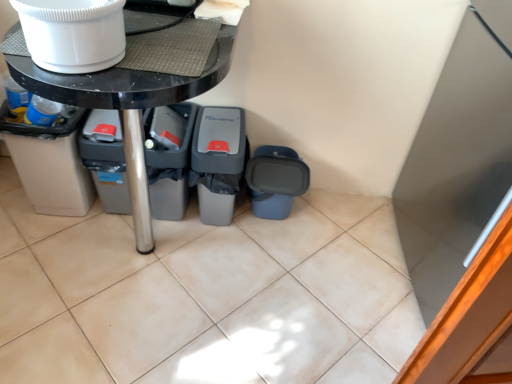
Where is `free space between white glossy refrigerator at upper right and blue matte recycling bin at lower right, which appears as the 1th recycling bin when viewed from the right`? free space between white glossy refrigerator at upper right and blue matte recycling bin at lower right, which appears as the 1th recycling bin when viewed from the right is located at coordinates (345, 249).